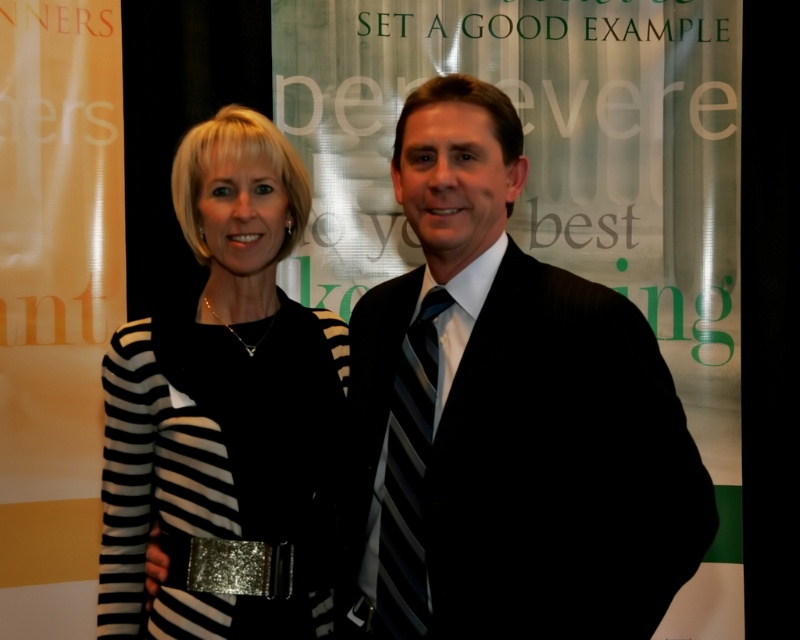
You are a photographer setting up for a group photo. You notice the black striped suit at center and the black striped tie at center in the frame. Which object should you adjust to ensure both are equally visible in the photo?

The black striped tie at center is shorter than the black striped suit at center. To make them equally visible, you should adjust the angle or focus on the black striped tie at center to compensate for its smaller size.

You are designing a layout for a poster and need to place an image of a black striped dress at center. The coordinates given are point (x=226, y=413). Is this point suitable for center placement?

The point (x=226, y=413) marks the black striped dress at center, so yes, this coordinate is suitable for center placement of the black striped dress at center.

You are organizing a charity event and need to decide which item to display first in the showcase. Both the black striped dress at center and the black striped tie at center are finalists. Based on their sizes, which one should be placed first to maximize visibility?

The black striped dress at center is taller than the black striped tie at center, so it should be placed first to maximize visibility as it is taller and more eye catching.